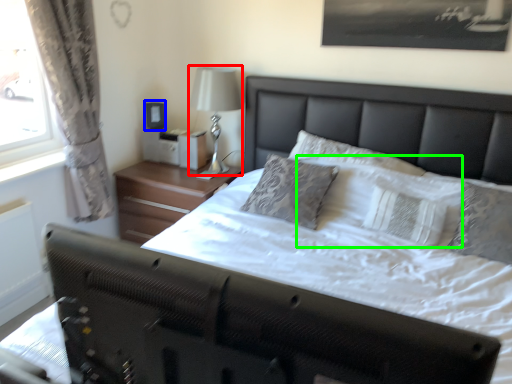
Question: Considering the real-world distances, which object is closest to bedside lamp (highlighted by a red box)? picture frame (highlighted by a blue box) or pillow (highlighted by a green box).

Choices:
 (A) picture frame
 (B) pillow

Answer: (A)